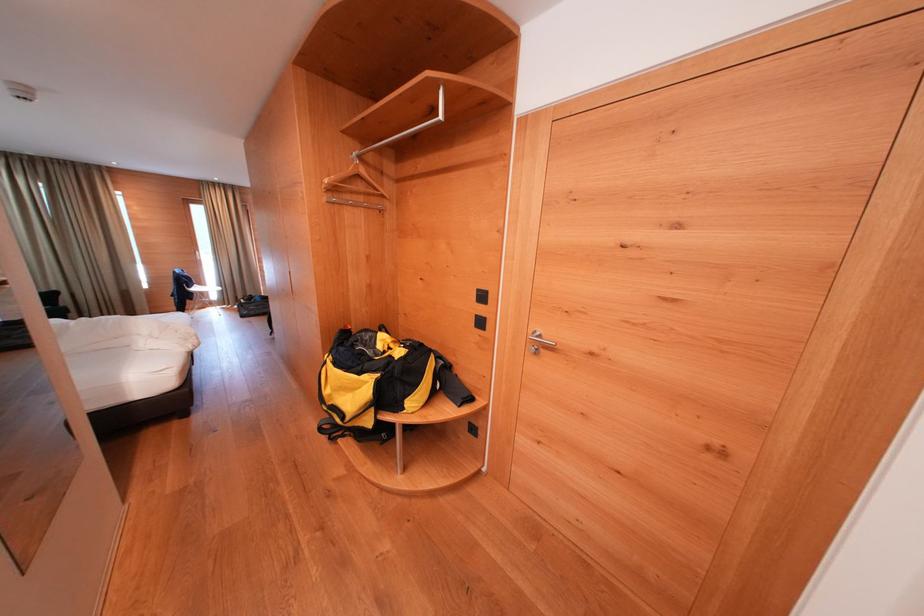
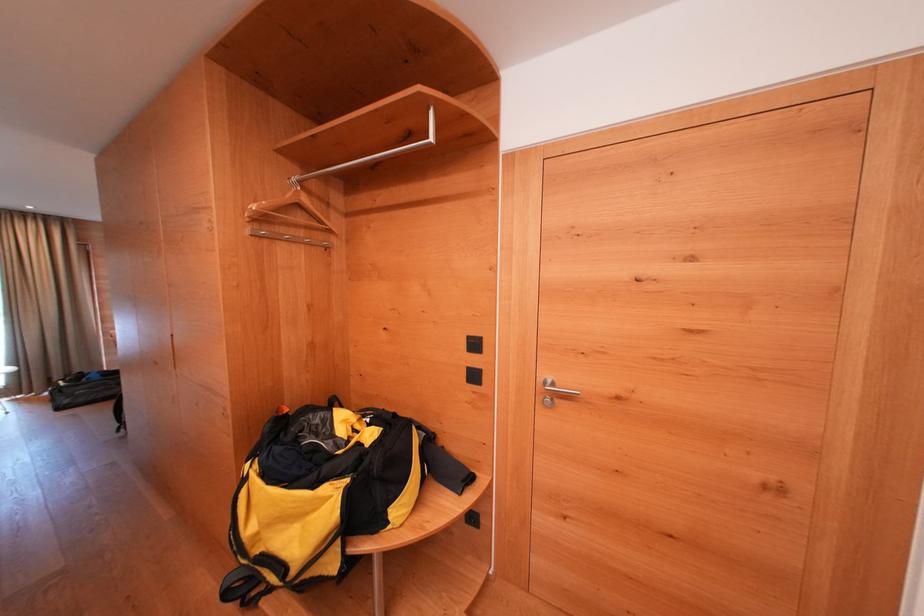
Locate, in the second image, the point that corresponds to (x=327, y=434) in the first image.

(234, 599)